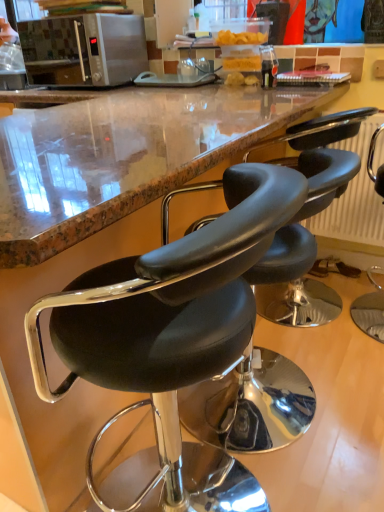
Question: Is black leather stool at center, arranged as the third chair when viewed from the right, wider or thinner than satin silver microwave at upper left?

Choices:
 (A) thin
 (B) wide

Answer: (B)

Question: Is point (193, 347) closer or farther from the camera than point (89, 84)?

Choices:
 (A) closer
 (B) farther

Answer: (A)

Question: Which object is positioned farthest from the black leather chair at right, the 3th chair in the left-to-right sequence?

Choices:
 (A) black leather stool at center, the 2th chair from the right
 (B) black leather stool at center, arranged as the third chair when viewed from the right
 (C) satin silver microwave at upper left

Answer: (C)

Question: Estimate the real-world distances between objects in this image. Which object is closer to the black leather chair at right, the 3th chair in the left-to-right sequence?

Choices:
 (A) black leather stool at center, arranged as the third chair when viewed from the right
 (B) satin silver microwave at upper left
 (C) black leather stool at center, the 2th chair from the right

Answer: (C)